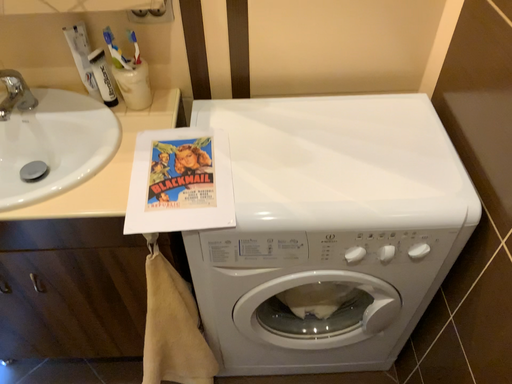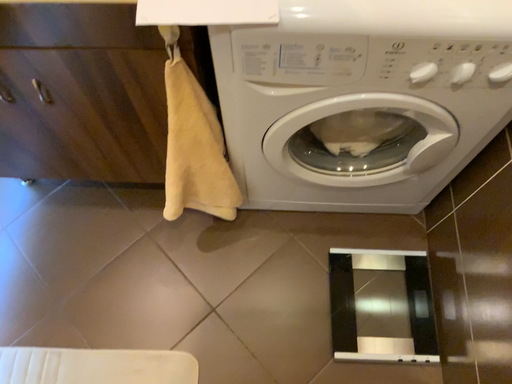
Question: How did the camera likely rotate when shooting the video?

Choices:
 (A) rotated upward
 (B) rotated downward

Answer: (B)